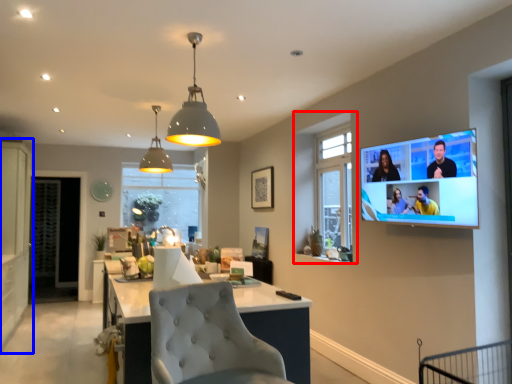
Question: Which of the following is the farthest to the observer, window (highlighted by a red box) or cabinetry (highlighted by a blue box)?

Choices:
 (A) window
 (B) cabinetry

Answer: (B)